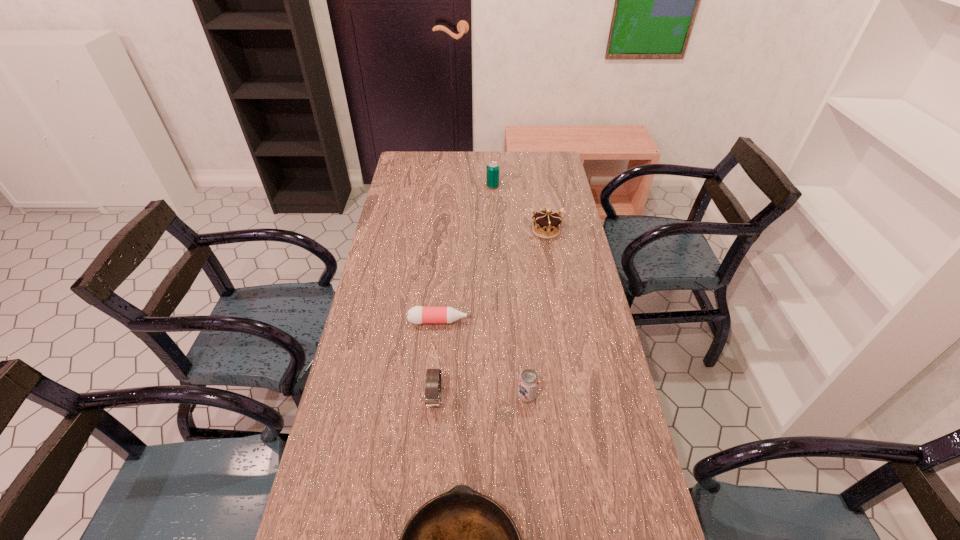
Locate an element on the screen. This screenshot has height=540, width=960. free spot between the shorter beer can and the crown is located at coordinates (537, 313).

You are a GUI agent. You are given a task and a screenshot of the screen. Output one action in this format:
    pyautogui.click(x=<x>, y=<y>)
    Task: Click on the empty location between the second farthest object and the nearer beer can
    
    Given the screenshot: What is the action you would take?
    pyautogui.click(x=537, y=313)

Locate an element on the screen. The image size is (960, 540). vacant space that's between the taller beer can and the watch is located at coordinates (464, 292).

The width and height of the screenshot is (960, 540). I want to click on free space that is in between the second farthest object and the shorter beer can, so click(537, 313).

This screenshot has width=960, height=540. In order to click on object that can be found as the fourth closest to the nearer beer can in this screenshot , I will do `click(546, 224)`.

Select which object appears as the third closest to the crown. Please provide its 2D coordinates. Your answer should be formatted as a tuple, i.e. [(x, y)], where the tuple contains the x and y coordinates of a point satisfying the conditions above.

[(528, 383)]

I want to click on free space in the image that satisfies the following two spatial constraints: 1. on the front side of the farther beer can; 2. with the cap open on the bottle, so click(x=498, y=321).

The width and height of the screenshot is (960, 540). In order to click on vacant space that satisfies the following two spatial constraints: 1. with the cap open on the fourth nearest object; 2. on the back side of the right beer can in this screenshot , I will do `click(434, 395)`.